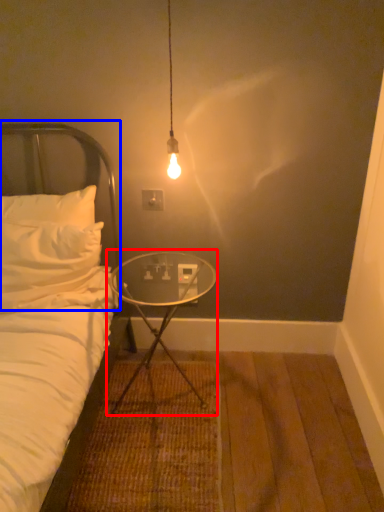
Question: Which point is further to the camera, table (highlighted by a red box) or headboard (highlighted by a blue box)?

Choices:
 (A) table
 (B) headboard

Answer: (B)